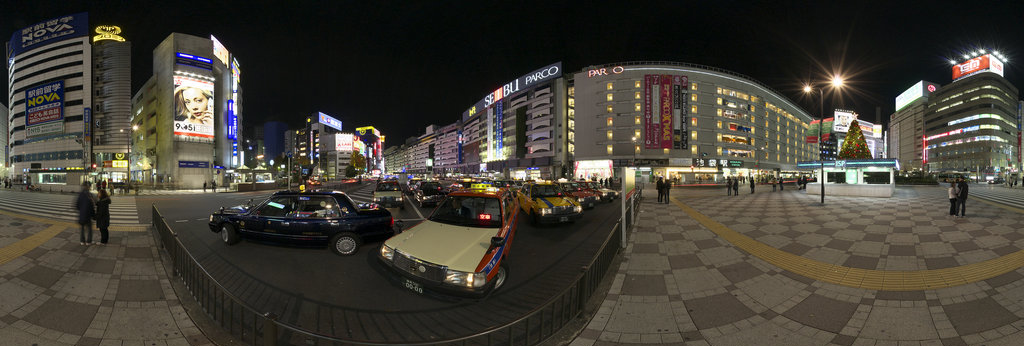
Identify the location of light. (838, 61).